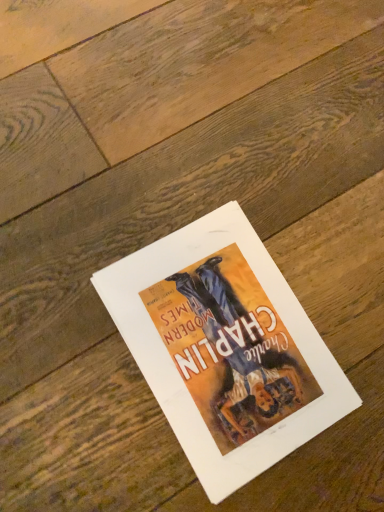
In order to click on blank space situated above matte paper poster at center (from a real-world perspective) in this screenshot , I will do `click(222, 342)`.